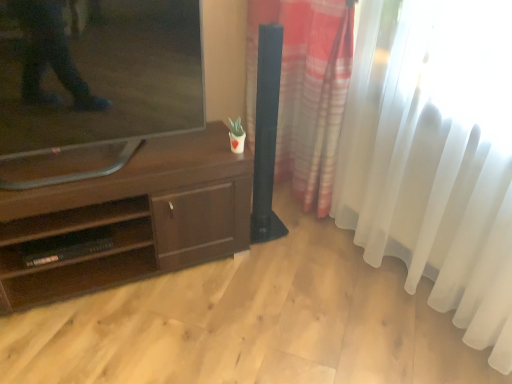
The width and height of the screenshot is (512, 384). I want to click on vacant space underneath matte black tv at left (from a real-world perspective), so click(x=99, y=163).